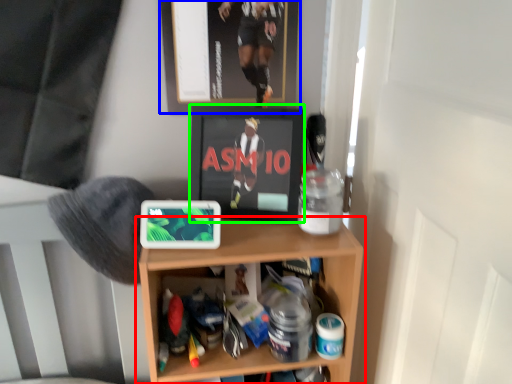
Question: Which object is the farthest from shelf (highlighted by a red box)? Choose among these: picture frame (highlighted by a blue box) or wide (highlighted by a green box).

Choices:
 (A) picture frame
 (B) wide

Answer: (A)